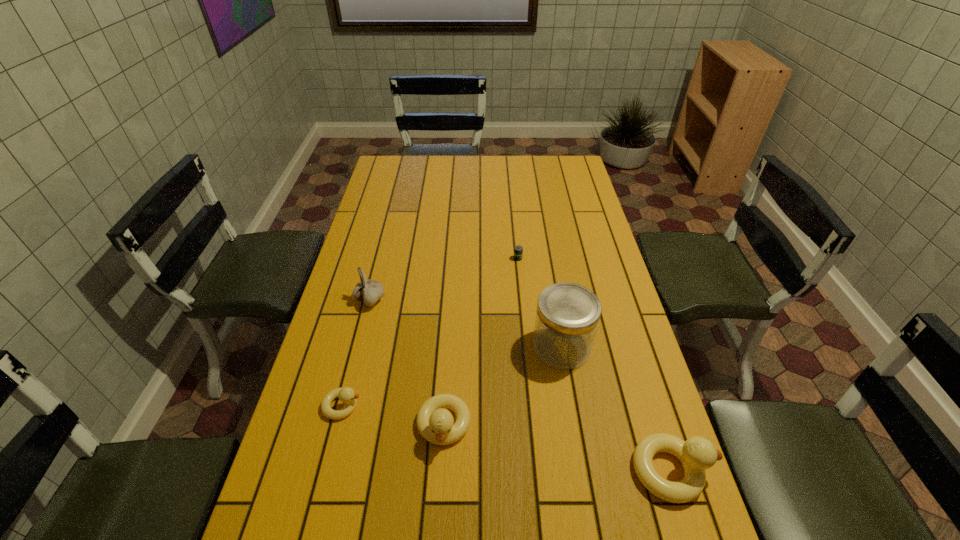
The height and width of the screenshot is (540, 960). In order to click on blank space located at the beak of the second shortest object in this screenshot , I will do `click(414, 406)`.

The height and width of the screenshot is (540, 960). What are the coordinates of `vacant region located 0.070m at the beak of the second duckling from right to left` in the screenshot? It's located at (440, 487).

This screenshot has height=540, width=960. In order to click on vacant area situated on the left of the farthest object in this screenshot , I will do `click(491, 258)`.

Find the location of a particular element. The height and width of the screenshot is (540, 960). vacant region located 0.130m on the back of the second farthest object is located at coordinates (379, 263).

Where is `blank space located 0.220m on the front of the jar`? The image size is (960, 540). blank space located 0.220m on the front of the jar is located at coordinates (579, 449).

I want to click on object present at the near edge, so click(x=697, y=454).

The image size is (960, 540). Identify the location of duckling that is at the left edge. tap(346, 395).

At what (x,y) coordinates should I click in order to perform the action: click on garlic present at the left edge. Please return your answer as a coordinate pair (x, y). Looking at the image, I should click on (369, 291).

At what (x,y) coordinates should I click in order to perform the action: click on duckling that is positioned at the right edge. Please return your answer as a coordinate pair (x, y). The image size is (960, 540). Looking at the image, I should click on (697, 454).

This screenshot has height=540, width=960. I want to click on jar present at the right edge, so click(567, 317).